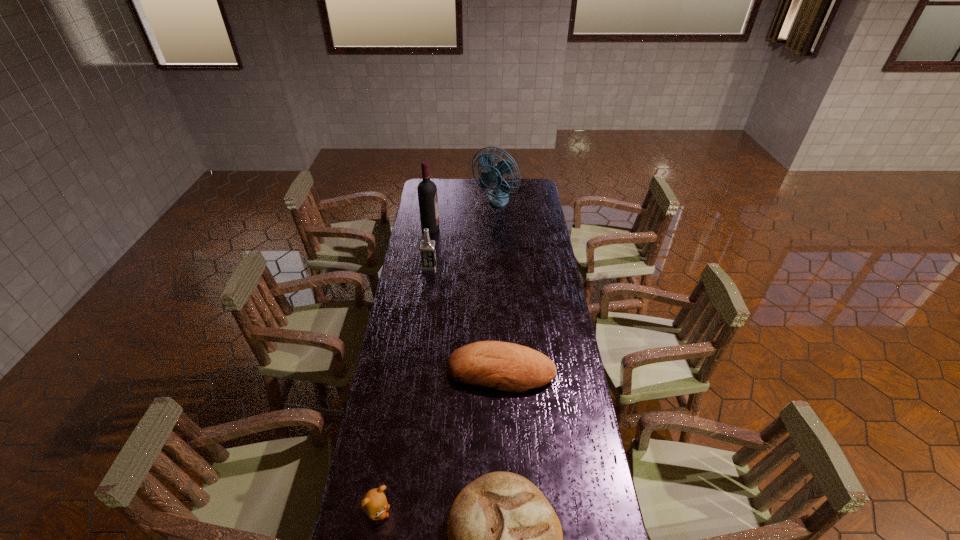
You are a GUI agent. You are given a task and a screenshot of the screen. Output one action in this format:
    pyautogui.click(x=<x>, y=<y>)
    Task: Click on the wine bottle
    This screenshot has width=960, height=540.
    Given the screenshot: What is the action you would take?
    pyautogui.click(x=427, y=190)

The height and width of the screenshot is (540, 960). I want to click on fan, so click(498, 197).

Identify the location of the third farthest object. The width and height of the screenshot is (960, 540). (427, 247).

Locate an element on the screen. vodka is located at coordinates (427, 247).

At what (x,y) coordinates should I click in order to perform the action: click on teddy bear. Please return your answer as a coordinate pair (x, y). The width and height of the screenshot is (960, 540). Looking at the image, I should click on (374, 503).

At what (x,y) coordinates should I click in order to perform the action: click on the fourth farthest object. Please return your answer as a coordinate pair (x, y). Image resolution: width=960 pixels, height=540 pixels. Looking at the image, I should click on (504, 366).

This screenshot has height=540, width=960. I want to click on the taller bread, so click(x=504, y=366).

This screenshot has width=960, height=540. Find the location of `free space located on the label of the second farthest object`. free space located on the label of the second farthest object is located at coordinates point(455,228).

The width and height of the screenshot is (960, 540). Identify the location of vacant space located in front of the fan to blow air. (497, 248).

The height and width of the screenshot is (540, 960). I want to click on free space located on the front label of the third tallest object, so click(470, 266).